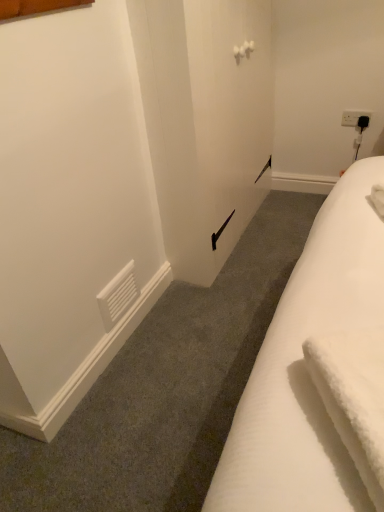
This screenshot has width=384, height=512. Describe the element at coordinates (354, 398) in the screenshot. I see `white fluffy bath towel at lower right` at that location.

Identify the location of white fluffy bath towel at lower right. The height and width of the screenshot is (512, 384). (354, 398).

Identify the location of white plastic electric outlet at upper right. (352, 117).

What do you see at coordinates (352, 117) in the screenshot? I see `white plastic electric outlet at upper right` at bounding box center [352, 117].

Identify the location of white fluffy bath towel at lower right. (354, 398).

Based on the photo, is white plastic electric outlet at upper right at the left side of white fluffy bath towel at lower right?

In fact, white plastic electric outlet at upper right is to the right of white fluffy bath towel at lower right.

Which object is closer to the camera taking this photo, white plastic electric outlet at upper right or white fluffy bath towel at lower right?

white fluffy bath towel at lower right is in front.

Which is closer, (x=353, y=125) or (x=324, y=349)?

Point (x=353, y=125) appears to be farther away from the viewer than point (x=324, y=349).

In the scene shown: From the image's perspective, does white plastic electric outlet at upper right appear higher than white fluffy bath towel at lower right?

Yes, from the image's perspective, white plastic electric outlet at upper right is over white fluffy bath towel at lower right.

From a real-world perspective, who is located higher, white plastic electric outlet at upper right or white fluffy bath towel at lower right?

In real-world perspective, white fluffy bath towel at lower right is above.

Is white plastic electric outlet at upper right wider or thinner than white fluffy bath towel at lower right?

Considering their sizes, white plastic electric outlet at upper right looks slimmer than white fluffy bath towel at lower right.

Between white plastic electric outlet at upper right and white fluffy bath towel at lower right, which one has less height?

With less height is white plastic electric outlet at upper right.

Can you confirm if white plastic electric outlet at upper right is bigger than white fluffy bath towel at lower right?

No.

Is white plastic electric outlet at upper right completely or partially outside of white fluffy bath towel at lower right?

Indeed, white plastic electric outlet at upper right is completely outside white fluffy bath towel at lower right.

Based on the photo, can you see white plastic electric outlet at upper right touching white fluffy bath towel at lower right?

No, white plastic electric outlet at upper right is not touching white fluffy bath towel at lower right.

Is white plastic electric outlet at upper right oriented towards white fluffy bath towel at lower right?

Yes, white plastic electric outlet at upper right faces towards white fluffy bath towel at lower right.

Locate an element on the screen. bath towel that appears above the white plastic electric outlet at upper right (from a real-world perspective) is located at coordinates (354, 398).

Is white fluffy bath towel at lower right to the left of white plastic electric outlet at upper right from the viewer's perspective?

Indeed, white fluffy bath towel at lower right is positioned on the left side of white plastic electric outlet at upper right.

Which object is closer to the camera taking this photo, white fluffy bath towel at lower right or white plastic electric outlet at upper right?

white fluffy bath towel at lower right is more forward.

Which is more distant, (331,347) or (347,120)?

The point (347,120) is more distant.

From the image's perspective, which is above, white fluffy bath towel at lower right or white plastic electric outlet at upper right?

white plastic electric outlet at upper right appears higher in the image.

From a real-world perspective, relative to white plastic electric outlet at upper right, is white fluffy bath towel at lower right vertically above or below?

white fluffy bath towel at lower right is situated higher than white plastic electric outlet at upper right in the real world.

In terms of width, does white fluffy bath towel at lower right look wider or thinner when compared to white plastic electric outlet at upper right?

In the image, white fluffy bath towel at lower right appears to be wider than white plastic electric outlet at upper right.

In the scene shown: From their relative heights in the image, would you say white fluffy bath towel at lower right is taller or shorter than white plastic electric outlet at upper right?

white fluffy bath towel at lower right is taller than white plastic electric outlet at upper right.

Considering the sizes of objects white fluffy bath towel at lower right and white plastic electric outlet at upper right in the image provided, who is smaller, white fluffy bath towel at lower right or white plastic electric outlet at upper right?

white plastic electric outlet at upper right.

Can we say white fluffy bath towel at lower right lies outside white plastic electric outlet at upper right?

white fluffy bath towel at lower right is positioned outside white plastic electric outlet at upper right.

Is white fluffy bath towel at lower right beside white plastic electric outlet at upper right?

No, white fluffy bath towel at lower right is not touching white plastic electric outlet at upper right.

Does white fluffy bath towel at lower right turn towards white plastic electric outlet at upper right?

No, white fluffy bath towel at lower right is not oriented towards white plastic electric outlet at upper right.

The image size is (384, 512). Identify the location of electric outlet on the right of white fluffy bath towel at lower right. point(352,117).

Where is `electric outlet located behind the white fluffy bath towel at lower right`? electric outlet located behind the white fluffy bath towel at lower right is located at coordinates (352, 117).

Where is `bath towel lying in front of the white plastic electric outlet at upper right`? bath towel lying in front of the white plastic electric outlet at upper right is located at coordinates (354, 398).